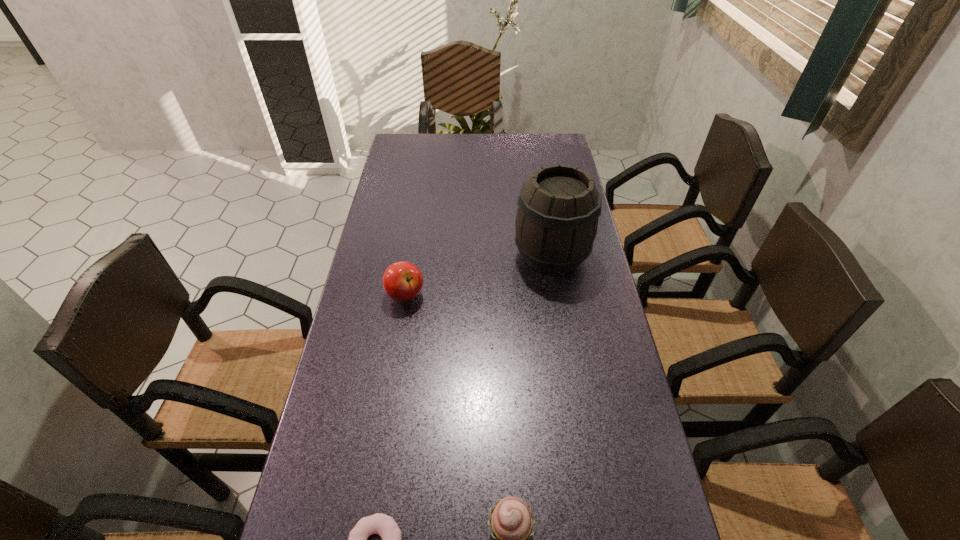
Locate an element on the screen. empty location between the tallest object and the apple is located at coordinates [x=478, y=275].

At what (x,y) coordinates should I click in order to perform the action: click on the closest object to the apple. Please return your answer as a coordinate pair (x, y). Looking at the image, I should click on (556, 223).

Identify which object is the third closest to the tallest object. Please provide its 2D coordinates. Your answer should be formatted as a tuple, i.e. [(x, y)], where the tuple contains the x and y coordinates of a point satisfying the conditions above.

[(385, 526)]

Locate an element on the screen. The height and width of the screenshot is (540, 960). vacant region that satisfies the following two spatial constraints: 1. on the back side of the apple; 2. on the right side of the wine bucket is located at coordinates (412, 255).